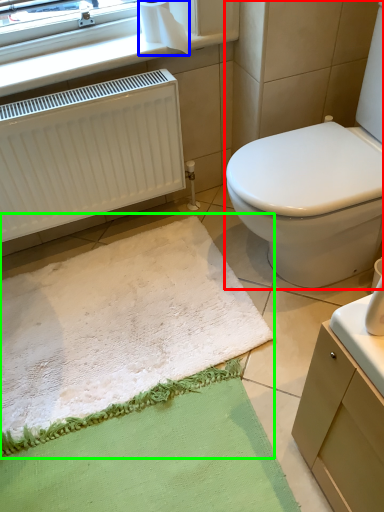
Question: Considering the real-world distances, which object is closest to toilet (highlighted by a red box)? toilet paper (highlighted by a blue box) or bath mat (highlighted by a green box).

Choices:
 (A) toilet paper
 (B) bath mat

Answer: (B)